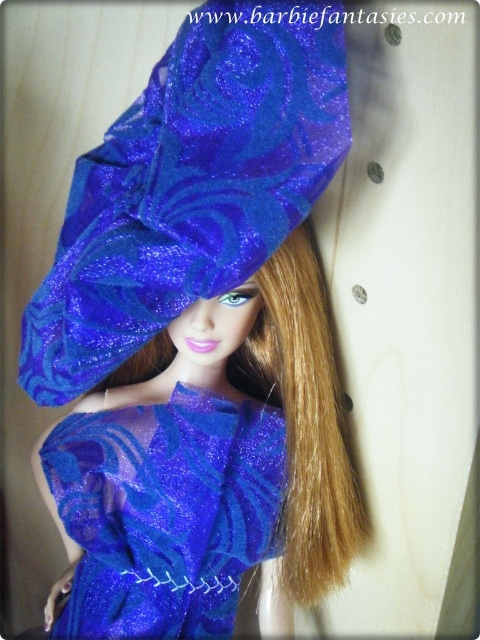
Does shiny blue fabric hat at upper center have a smaller size compared to shiny blue fabric dress at center?

Incorrect, shiny blue fabric hat at upper center is not smaller in size than shiny blue fabric dress at center.

Which is below, shiny blue fabric hat at upper center or shiny blue fabric dress at center?

shiny blue fabric dress at center

Consider the image. Measure the distance between shiny blue fabric hat at upper center and camera.

33.19 inches

Locate an element on the screen. The height and width of the screenshot is (640, 480). shiny blue fabric hat at upper center is located at coordinates (190, 186).